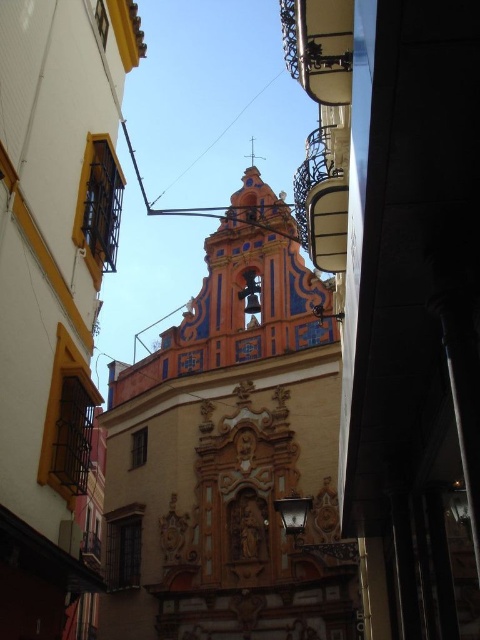
Question: Does orange painted stone church at center have a smaller size compared to ornate painted facade at center?

Choices:
 (A) no
 (B) yes

Answer: (A)

Question: From the image, what is the correct spatial relationship of orange painted stone church at center in relation to ornate painted facade at center?

Choices:
 (A) below
 (B) above

Answer: (A)

Question: Among these points, which one is farthest from the camera?

Choices:
 (A) (35, 326)
 (B) (107, 596)

Answer: (B)

Question: Is orange painted stone church at center further to camera compared to ornate painted facade at center?

Choices:
 (A) yes
 (B) no

Answer: (A)